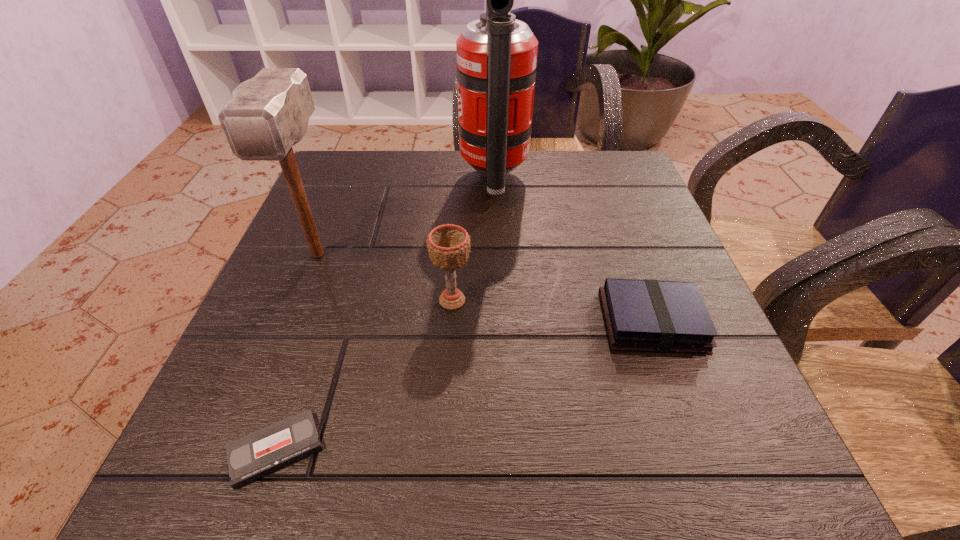
I want to click on fire extinguisher, so click(497, 54).

Locate an element on the screen. The height and width of the screenshot is (540, 960). the farthest object is located at coordinates tap(497, 54).

Find the location of a particular element. Image resolution: width=960 pixels, height=540 pixels. the fourth shortest object is located at coordinates (268, 114).

The height and width of the screenshot is (540, 960). What are the coordinates of `the fourth nearest object` in the screenshot? It's located at (268, 114).

In order to click on the third tallest object in this screenshot , I will do point(448,245).

Identify the location of the rightmost object. (660, 316).

This screenshot has height=540, width=960. Identify the location of book. (660, 316).

The image size is (960, 540). Identify the location of videotape. (255, 455).

The height and width of the screenshot is (540, 960). I want to click on the nearest object, so click(x=255, y=455).

Locate an element on the screen. This screenshot has height=540, width=960. vacant region located 0.220m on the front label side of the farthest object is located at coordinates (369, 180).